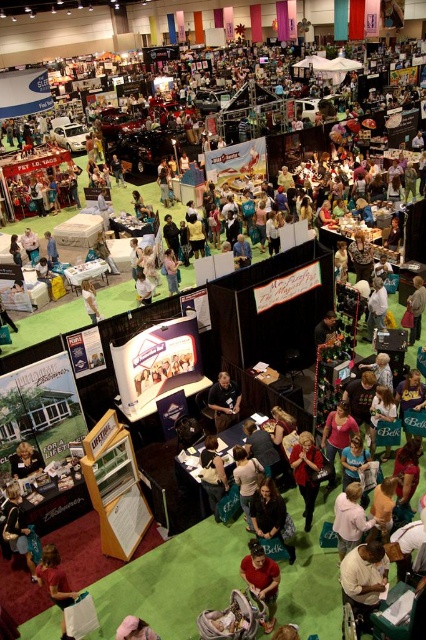
Looking at this image, you are a photographer at this event and need to capture both the white matte shirt at lower center and the light brown leather jacket at center in a single photo. Which clothing item will appear larger in the photo?

The white matte shirt at lower center will appear larger in the photo because it is much taller than the light brown leather jacket at center.

Looking at this image, you are a photographer at the event and want to capture a clear shot of both the golden hair at center and the black leather jacket at center. Since you need to adjust your camera settings for height, which object should you focus on first to ensure both are in frame?

The golden hair at center is taller than the black leather jacket at center. You should focus on the golden hair at center first to ensure both are in frame.

In the scene shown: You are attending a trade show and notice a dark green fabric bag at center and a light brown leather jacket at center. Which item is placed lower in the image?

The dark green fabric bag at center is positioned under the light brown leather jacket at center, so it is placed lower in the image.